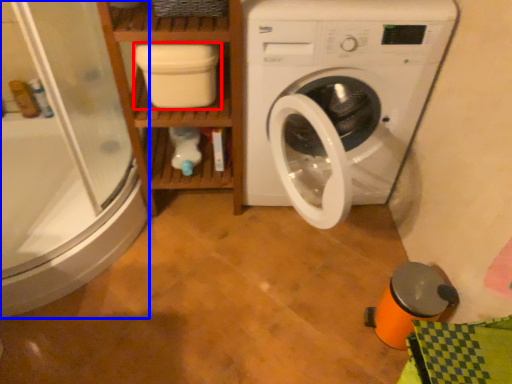
Question: Which of the following is the closest to the observer, dish washer (highlighted by a red box) or shower door (highlighted by a blue box)?

Choices:
 (A) dish washer
 (B) shower door

Answer: (B)